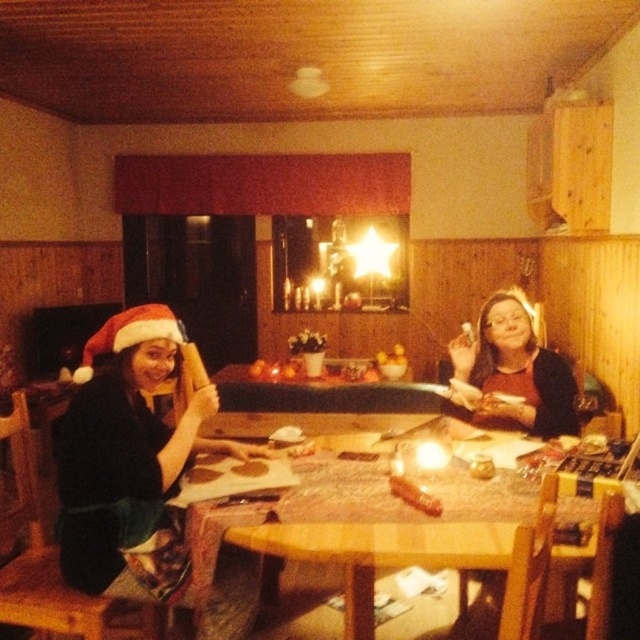
You are standing in the dining area and want to reach the point marked as point (355,616). If your reach is 1.5 meters, can you grab something placed exactly at that point without moving closer?

The point (355,616) is 1.78 meters away from the viewer. Since your reach is only 1.5 meters, you cannot grab something placed at that point without moving closer.

You are at the dining table and want to place a gift under the table. The gift requires a space of 0.15 meters in width. Is the space between the matte black santa hat at left and the edge of the table sufficient?

The space between the matte black santa hat at left and the edge of the table is 0.2 meters, so yes, the gift can be placed there as the required space is 0.15 meters.

You are a guest at this festive gathering and want to place a small gift under the table. The table has four legs positioned at the corners. To ensure the gift doesn not get in the way of the matte black santa hat at left, where should you place it?

Place the small gift near the table leg opposite to the matte black santa hat at left, which is at point (131, 458). This ensures it stays clear of the hat.